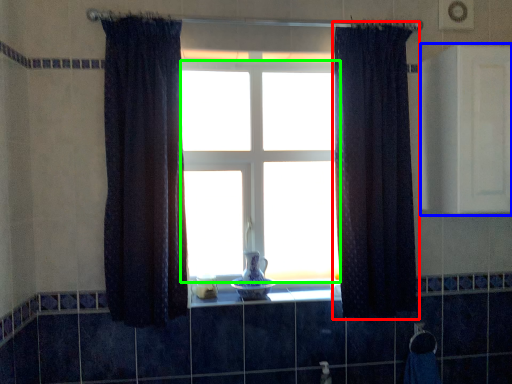
Question: Which object is positioned closest to curtain (highlighted by a red box)? Select from medicine cabinet (highlighted by a blue box) and bay window (highlighted by a green box).

Choices:
 (A) medicine cabinet
 (B) bay window

Answer: (A)